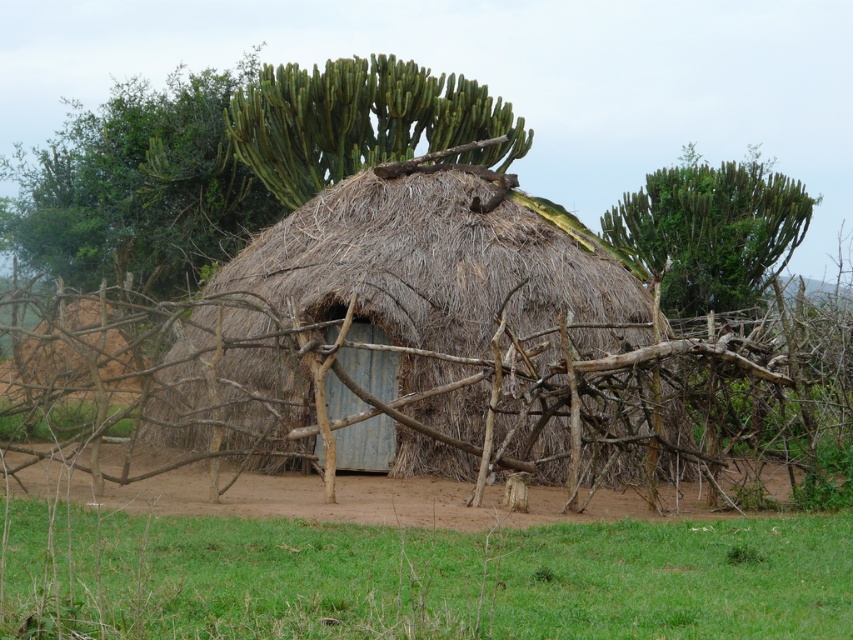
Question: Which of these objects is positioned farthest from the green grass at lower center?

Choices:
 (A) green spiky cactus at upper left
 (B) green spiky cactus at upper center
 (C) green spiky cactus at upper right

Answer: (A)

Question: Does thatched straw hut at center have a larger size compared to green spiky cactus at upper right?

Choices:
 (A) no
 (B) yes

Answer: (A)

Question: Is green spiky cactus at upper left bigger than green spiky cactus at upper right?

Choices:
 (A) no
 (B) yes

Answer: (B)

Question: Which of the following is the farthest from the observer?

Choices:
 (A) thatched straw hut at center
 (B) green grass at lower center
 (C) green spiky cactus at upper center

Answer: (C)

Question: Estimate the real-world distances between objects in this image. Which object is farther from the thatched straw hut at center?

Choices:
 (A) green grass at lower center
 (B) green spiky cactus at upper right
 (C) green spiky cactus at upper center

Answer: (B)

Question: Observing the image, what is the correct spatial positioning of thatched straw hut at center in reference to green spiky cactus at upper right?

Choices:
 (A) above
 (B) below

Answer: (B)